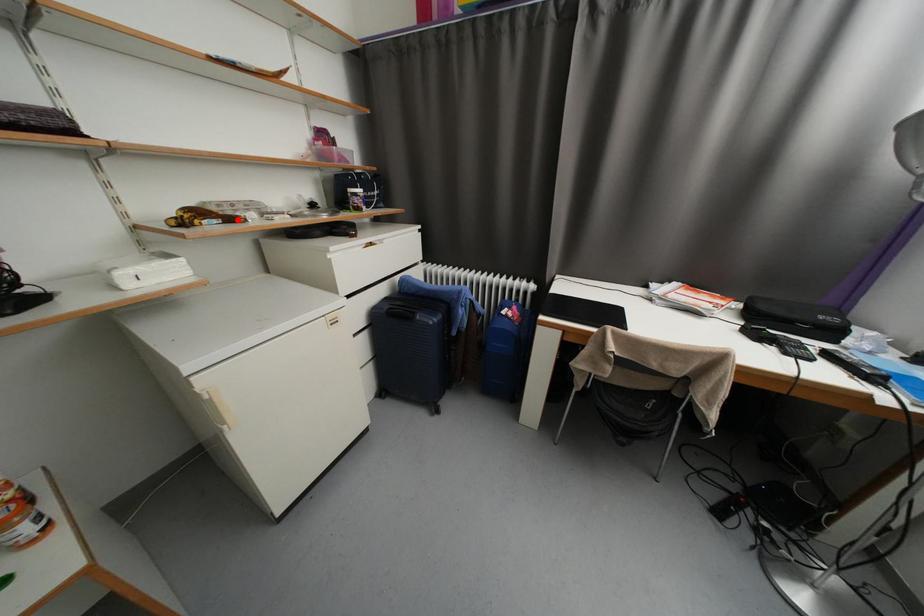
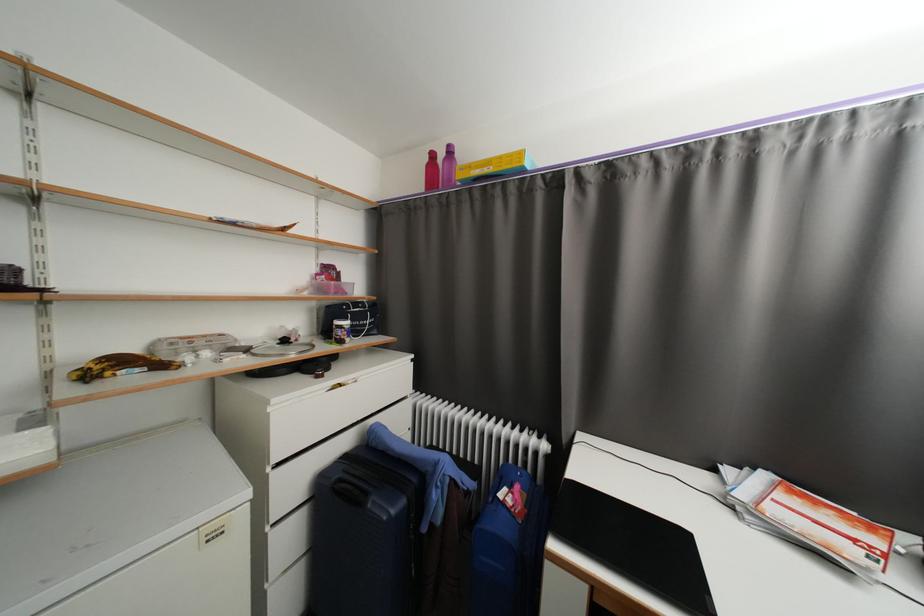
Find the pixel in the second image that matches the highlighted location in the first image.

(167, 367)